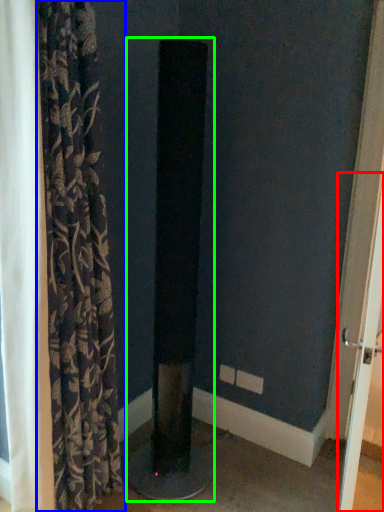
Question: Which is farther away from screen door (highlighted by a red box)? curtain (highlighted by a blue box) or pillar (highlighted by a green box)?

Choices:
 (A) curtain
 (B) pillar

Answer: (A)